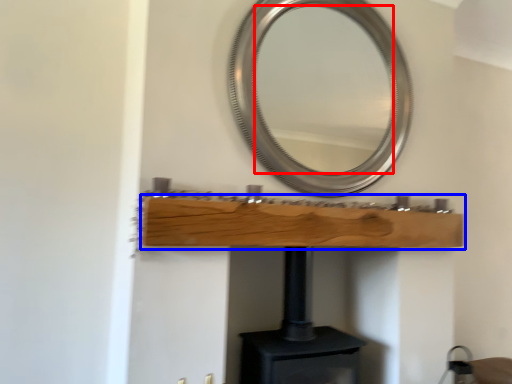
Question: Which object appears closest to the camera in this image, mirror (highlighted by a red box) or shelf (highlighted by a blue box)?

Choices:
 (A) mirror
 (B) shelf

Answer: (B)